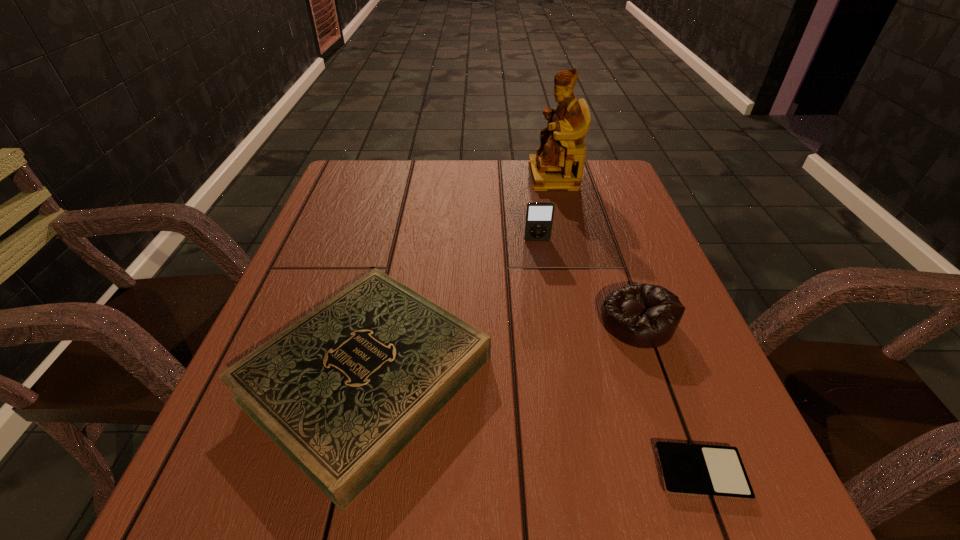
This screenshot has height=540, width=960. I want to click on vacant area situated on the front-facing side of the farthest object, so click(x=425, y=177).

I want to click on free spot located 0.130m on the front-facing side of the farthest object, so click(x=485, y=177).

Identify the location of vacant space located on the front-facing side of the second tallest object. (554, 345).

Identify the location of vacant area situated 0.100m on the left of the beanbag. (549, 321).

This screenshot has width=960, height=540. In order to click on vacant space located on the back of the second shortest object in this screenshot , I will do `click(390, 270)`.

Identify the location of vacant region located on the back of the shorter iPod. The width and height of the screenshot is (960, 540). (638, 303).

Where is `object that is at the far edge`? The image size is (960, 540). object that is at the far edge is located at coordinates (558, 164).

Identify the location of hardback book located in the near edge section of the desktop. This screenshot has width=960, height=540. (343, 390).

You are a GUI agent. You are given a task and a screenshot of the screen. Output one action in this format:
    pyautogui.click(x=<x>, y=<y>)
    Task: Click on the iPod situated at the near edge
    Image resolution: width=960 pixels, height=540 pixels.
    Given the screenshot: What is the action you would take?
    tap(712, 471)

Locate an element on the screen. The image size is (960, 540). object that is at the left edge is located at coordinates pyautogui.click(x=343, y=390).